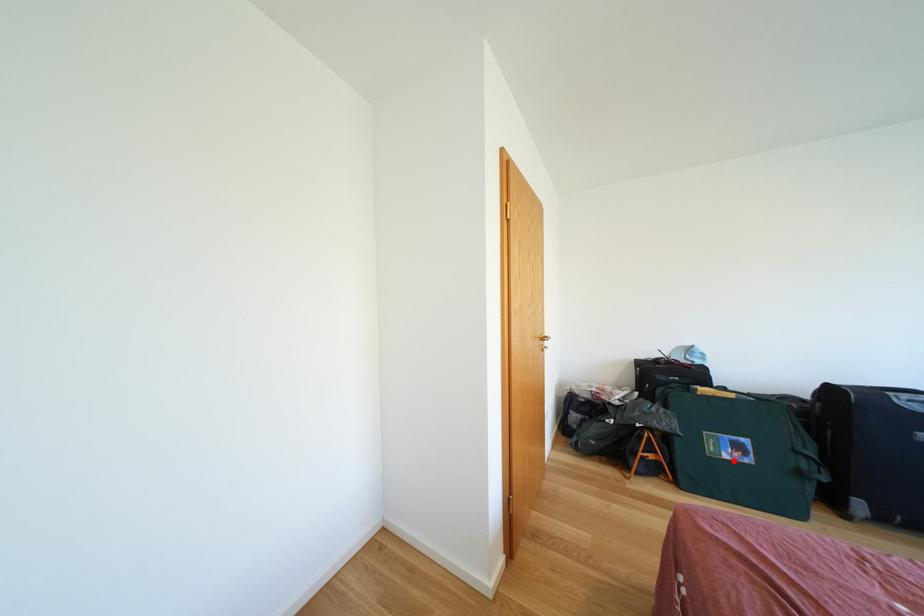
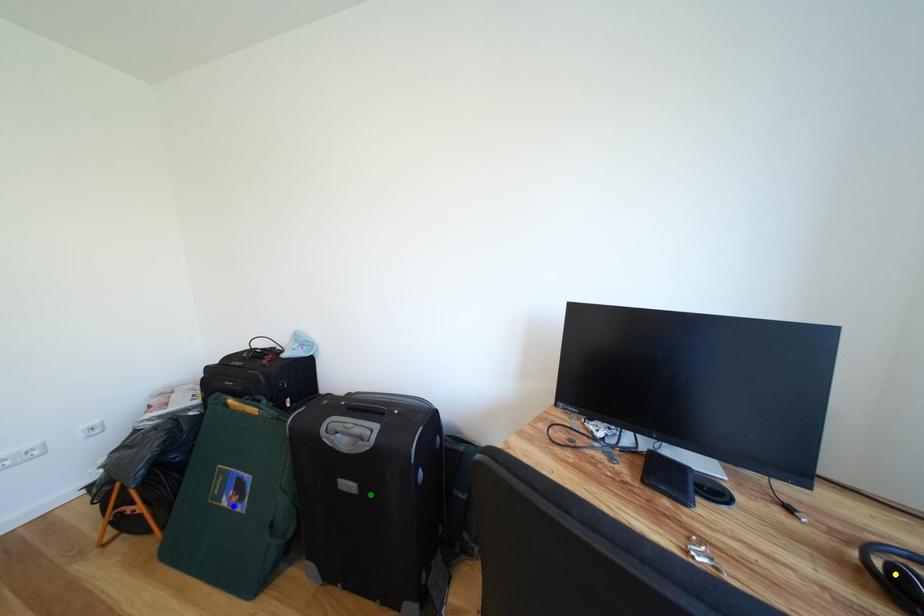
Question: I am providing you with two images of the same scene from different viewpoints. A red point is marked on the first image. You are given multiple points on the second image. Can you choose the point in image 2 that corresponds to the point in image 1?

Choices:
 (A) blue point
 (B) green point
 (C) yellow point

Answer: (A)